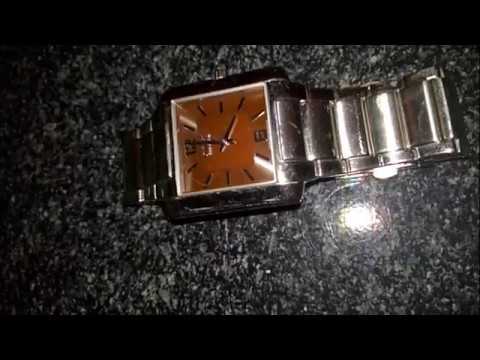
In order to click on reflection on tabletop in this screenshot , I will do `click(364, 217)`.